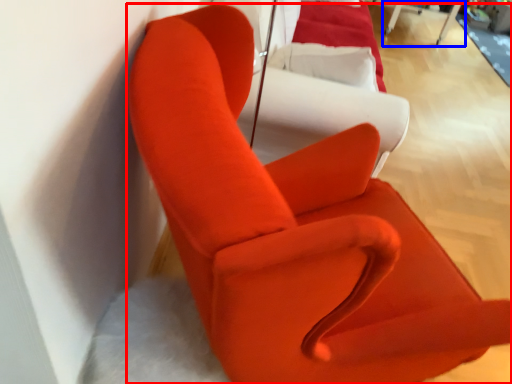
Question: Which object appears farthest to the camera in this image, chair (highlighted by a red box) or table (highlighted by a blue box)?

Choices:
 (A) chair
 (B) table

Answer: (B)